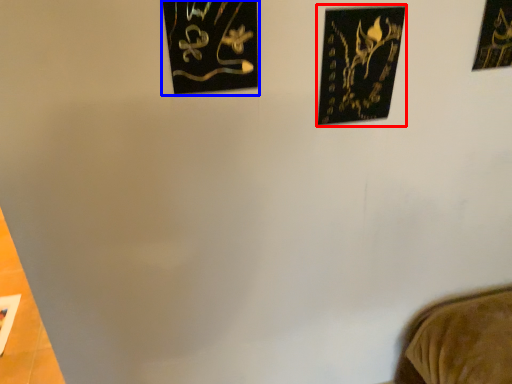
Question: Which object is further to the camera taking this photo, picture frame (highlighted by a red box) or picture frame (highlighted by a blue box)?

Choices:
 (A) picture frame
 (B) picture frame

Answer: (A)